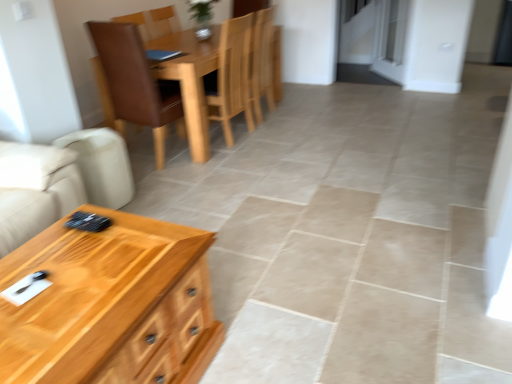
This screenshot has height=384, width=512. In order to click on wooden chair at center, the second chair in the left-to-right sequence in this screenshot , I will do `click(232, 76)`.

Describe the element at coordinates (232, 76) in the screenshot. Image resolution: width=512 pixels, height=384 pixels. I see `wooden chair at center, the second chair in the left-to-right sequence` at that location.

This screenshot has width=512, height=384. Describe the element at coordinates (110, 305) in the screenshot. I see `wooden coffee table at lower left` at that location.

This screenshot has width=512, height=384. I want to click on brown leather chair at upper center, marked as the first chair in a left-to-right arrangement, so click(133, 84).

From the image's perspective, between wooden chair at center, the second chair in the left-to-right sequence, and brown leather chair at upper center, which is counted as the 2th chair, starting from the right, who is located below?

brown leather chair at upper center, which is counted as the 2th chair, starting from the right.

Considering the sizes of objects wooden chair at center, the second chair in the left-to-right sequence, and brown leather chair at upper center, which is counted as the 2th chair, starting from the right, in the image provided, who is taller, wooden chair at center, the second chair in the left-to-right sequence, or brown leather chair at upper center, which is counted as the 2th chair, starting from the right,?

With more height is brown leather chair at upper center, which is counted as the 2th chair, starting from the right.

Is wooden chair at center, positioned as the first chair in right-to-left order, surrounding brown leather chair at upper center, marked as the first chair in a left-to-right arrangement?

That's incorrect, brown leather chair at upper center, marked as the first chair in a left-to-right arrangement, is not inside wooden chair at center, positioned as the first chair in right-to-left order.

From the image's perspective, is brown leather chair at upper center, which is counted as the 2th chair, starting from the right, located above or below wooden coffee table at lower left?

From the image's perspective, brown leather chair at upper center, which is counted as the 2th chair, starting from the right, appears above wooden coffee table at lower left.

Which is more to the left, brown leather chair at upper center, which is counted as the 2th chair, starting from the right, or wooden coffee table at lower left?

Positioned to the left is brown leather chair at upper center, which is counted as the 2th chair, starting from the right.

Is point (177, 101) closer to camera compared to point (137, 328)?

No, (177, 101) is behind (137, 328).

Which is correct: brown leather chair at upper center, which is counted as the 2th chair, starting from the right, is inside wooden coffee table at lower left, or outside of it?

brown leather chair at upper center, which is counted as the 2th chair, starting from the right, lies outside wooden coffee table at lower left.

Find the location of `table lying below the wooden chair at center, the second chair in the left-to-right sequence (from the image's perspective)`. table lying below the wooden chair at center, the second chair in the left-to-right sequence (from the image's perspective) is located at coordinates pos(110,305).

What's the angular difference between wooden coffee table at lower left and wooden chair at center, the second chair in the left-to-right sequence,'s facing directions?

The facing directions of wooden coffee table at lower left and wooden chair at center, the second chair in the left-to-right sequence, are 180 degrees apart.

Can you confirm if wooden coffee table at lower left is positioned to the right of wooden chair at center, positioned as the first chair in right-to-left order?

No.

Is wooden coffee table at lower left placed right next to wooden chair at center, positioned as the first chair in right-to-left order?

No, wooden coffee table at lower left is not touching wooden chair at center, positioned as the first chair in right-to-left order.

How many degrees apart are the facing directions of wooden coffee table at lower left and brown leather chair at upper center, which is counted as the 2th chair, starting from the right?

The angle between the facing direction of wooden coffee table at lower left and the facing direction of brown leather chair at upper center, which is counted as the 2th chair, starting from the right, is 82.7 degrees.

The height and width of the screenshot is (384, 512). Find the location of `table that appears below the brown leather chair at upper center, marked as the first chair in a left-to-right arrangement (from a real-world perspective)`. table that appears below the brown leather chair at upper center, marked as the first chair in a left-to-right arrangement (from a real-world perspective) is located at coordinates (110, 305).

How far apart are wooden coffee table at lower left and brown leather chair at upper center, marked as the first chair in a left-to-right arrangement?

The distance of wooden coffee table at lower left from brown leather chair at upper center, marked as the first chair in a left-to-right arrangement, is 5.89 feet.

Is point (99, 346) positioned in front of point (175, 66)?

Yes, it is.

Is brown leather chair at upper center, marked as the first chair in a left-to-right arrangement, inside or outside of wooden chair at center, positioned as the first chair in right-to-left order?

brown leather chair at upper center, marked as the first chair in a left-to-right arrangement, is spatially situated outside wooden chair at center, positioned as the first chair in right-to-left order.

Where is `chair behind the brown leather chair at upper center, marked as the first chair in a left-to-right arrangement`? chair behind the brown leather chair at upper center, marked as the first chair in a left-to-right arrangement is located at coordinates (232, 76).

Can you confirm if wooden chair at center, the second chair in the left-to-right sequence, is thinner than wooden coffee table at lower left?

Correct, the width of wooden chair at center, the second chair in the left-to-right sequence, is less than that of wooden coffee table at lower left.

The height and width of the screenshot is (384, 512). Find the location of `table in front of the wooden chair at center, the second chair in the left-to-right sequence`. table in front of the wooden chair at center, the second chair in the left-to-right sequence is located at coordinates (110, 305).

How different are the orientations of wooden chair at center, the second chair in the left-to-right sequence, and wooden coffee table at lower left in degrees?

180 degrees separate the facing orientations of wooden chair at center, the second chair in the left-to-right sequence, and wooden coffee table at lower left.

Does wooden chair at center, the second chair in the left-to-right sequence, contain wooden coffee table at lower left?

No, wooden coffee table at lower left is located outside of wooden chair at center, the second chair in the left-to-right sequence.

Find the location of `chair that appears above the brown leather chair at upper center, marked as the first chair in a left-to-right arrangement (from the image's perspective)`. chair that appears above the brown leather chair at upper center, marked as the first chair in a left-to-right arrangement (from the image's perspective) is located at coordinates (232, 76).

Where is `table below the brown leather chair at upper center, marked as the first chair in a left-to-right arrangement (from the image's perspective)`? The width and height of the screenshot is (512, 384). table below the brown leather chair at upper center, marked as the first chair in a left-to-right arrangement (from the image's perspective) is located at coordinates (110, 305).

Considering their positions, is wooden chair at center, positioned as the first chair in right-to-left order, positioned closer to brown leather chair at upper center, which is counted as the 2th chair, starting from the right, than wooden coffee table at lower left?

wooden chair at center, positioned as the first chair in right-to-left order, is positioned closer to the anchor brown leather chair at upper center, which is counted as the 2th chair, starting from the right.

Estimate the real-world distances between objects in this image. Which object is further from wooden coffee table at lower left, wooden chair at center, positioned as the first chair in right-to-left order, or brown leather chair at upper center, which is counted as the 2th chair, starting from the right?

Among the two, wooden chair at center, positioned as the first chair in right-to-left order, is located further to wooden coffee table at lower left.

Looking at the image, which one is located closer to brown leather chair at upper center, which is counted as the 2th chair, starting from the right, wooden coffee table at lower left or wooden chair at center, the second chair in the left-to-right sequence?

The object closer to brown leather chair at upper center, which is counted as the 2th chair, starting from the right, is wooden chair at center, the second chair in the left-to-right sequence.

Estimate the real-world distances between objects in this image. Which object is closer to wooden coffee table at lower left, brown leather chair at upper center, marked as the first chair in a left-to-right arrangement, or wooden chair at center, the second chair in the left-to-right sequence?

brown leather chair at upper center, marked as the first chair in a left-to-right arrangement, is positioned closer to the anchor wooden coffee table at lower left.

When comparing their distances from wooden chair at center, positioned as the first chair in right-to-left order, does wooden coffee table at lower left or brown leather chair at upper center, which is counted as the 2th chair, starting from the right, seem closer?

Among the two, brown leather chair at upper center, which is counted as the 2th chair, starting from the right, is located nearer to wooden chair at center, positioned as the first chair in right-to-left order.

Looking at the image, which one is located further to wooden chair at center, positioned as the first chair in right-to-left order, brown leather chair at upper center, marked as the first chair in a left-to-right arrangement, or wooden coffee table at lower left?

Based on the image, wooden coffee table at lower left appears to be further to wooden chair at center, positioned as the first chair in right-to-left order.

Identify the location of chair located between wooden coffee table at lower left and wooden chair at center, positioned as the first chair in right-to-left order, in the depth direction. Image resolution: width=512 pixels, height=384 pixels. (133, 84).